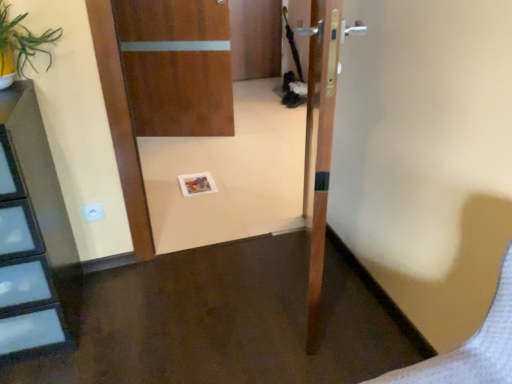
Question: Considering the relative sizes of wooden door at center, the second door when ordered from left to right, and white plastic electric outlet at lower left in the image provided, is wooden door at center, the second door when ordered from left to right, thinner than white plastic electric outlet at lower left?

Choices:
 (A) no
 (B) yes

Answer: (A)

Question: Can you confirm if wooden door at center, which is counted as the second door, starting from the back, is positioned to the right of white plastic electric outlet at lower left?

Choices:
 (A) yes
 (B) no

Answer: (A)

Question: Is white plastic electric outlet at lower left at the back of wooden door at center, which is counted as the second door, starting from the back?

Choices:
 (A) yes
 (B) no

Answer: (B)

Question: Can you confirm if wooden door at center, the second door when ordered from left to right, is shorter than white plastic electric outlet at lower left?

Choices:
 (A) no
 (B) yes

Answer: (A)

Question: Can you see wooden door at center, the second door when ordered from left to right, touching white plastic electric outlet at lower left?

Choices:
 (A) no
 (B) yes

Answer: (A)

Question: Can white plastic electric outlet at lower left be found inside wooden door at center, marked as the first door in a front-to-back arrangement?

Choices:
 (A) yes
 (B) no

Answer: (B)

Question: Is green leafy plant at upper left shorter than wooden door at center, placed as the 1th door when sorted from back to front?

Choices:
 (A) yes
 (B) no

Answer: (A)

Question: Considering the relative sizes of green leafy plant at upper left and wooden door at center, the 2th door viewed from the right, in the image provided, is green leafy plant at upper left smaller than wooden door at center, the 2th door viewed from the right,?

Choices:
 (A) no
 (B) yes

Answer: (B)

Question: Considering the relative sizes of green leafy plant at upper left and wooden door at center, placed as the 1th door when sorted from back to front, in the image provided, is green leafy plant at upper left taller than wooden door at center, placed as the 1th door when sorted from back to front,?

Choices:
 (A) no
 (B) yes

Answer: (A)

Question: Can we say green leafy plant at upper left lies outside wooden door at center, the 2th door viewed from the right?

Choices:
 (A) yes
 (B) no

Answer: (A)

Question: Would you say green leafy plant at upper left contains wooden door at center, arranged as the 1th door when viewed from the left?

Choices:
 (A) no
 (B) yes

Answer: (A)

Question: Is green leafy plant at upper left to the left of wooden door at center, arranged as the 1th door when viewed from the left, from the viewer's perspective?

Choices:
 (A) yes
 (B) no

Answer: (A)

Question: From the image's perspective, is green leafy plant at upper left below white plastic electric outlet at lower left?

Choices:
 (A) yes
 (B) no

Answer: (B)